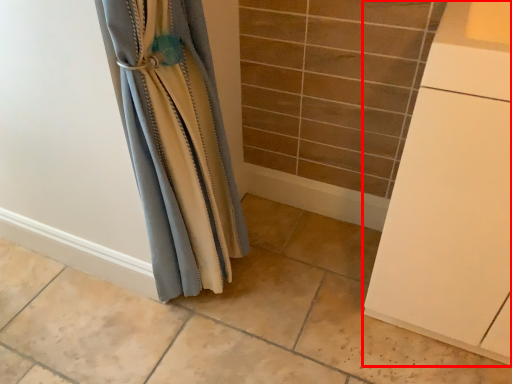
Question: From the image's perspective, what is the correct spatial relationship of cabinetry (annotated by the red box) in relation to curtain?

Choices:
 (A) above
 (B) below

Answer: (B)